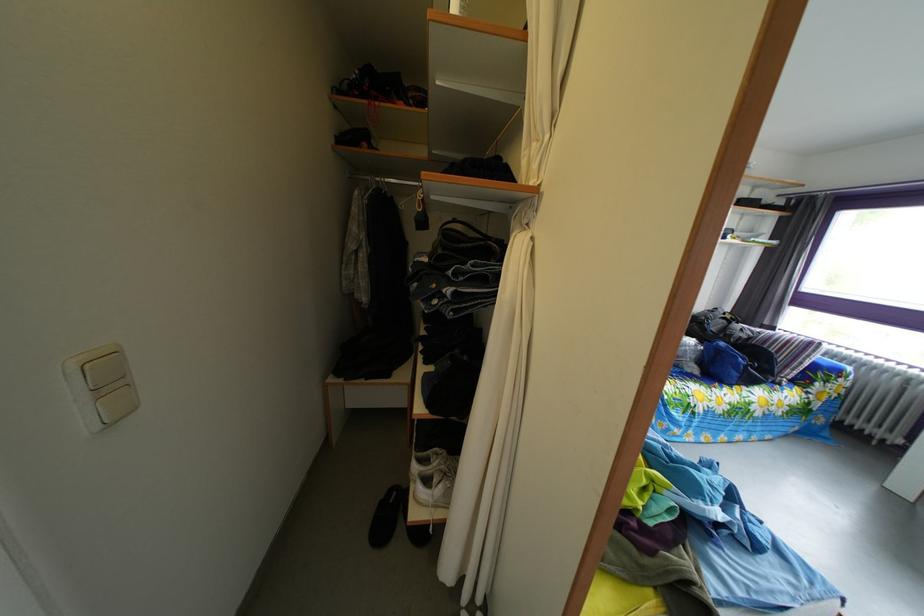
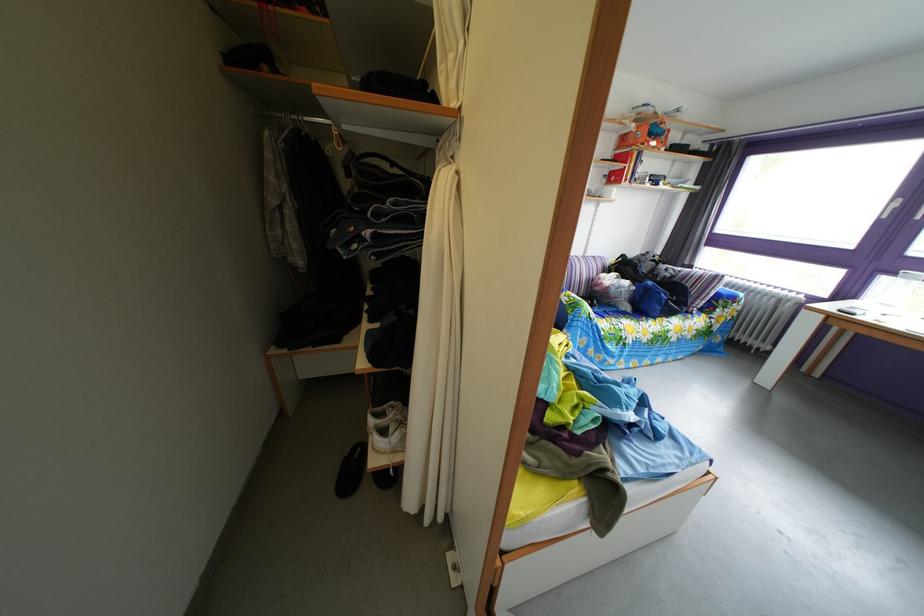
In the second image, find the point that corresponds to point (734, 352) in the first image.

(661, 291)